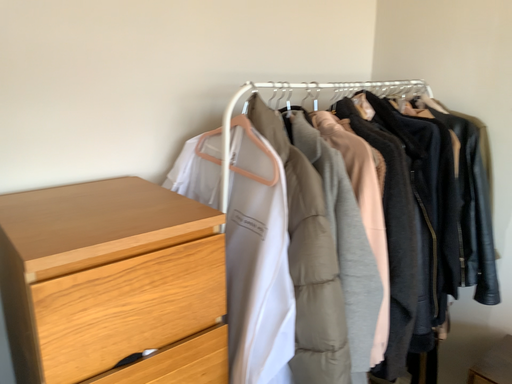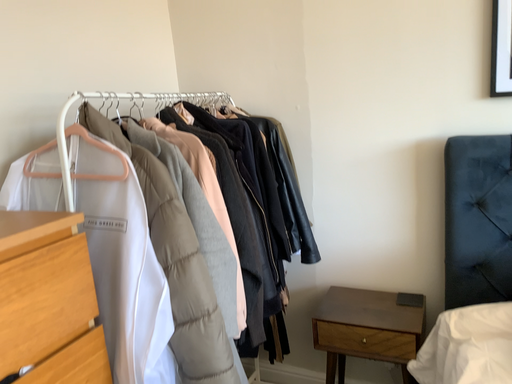
Question: How did the camera likely rotate when shooting the video?

Choices:
 (A) rotated downward
 (B) rotated upward

Answer: (B)